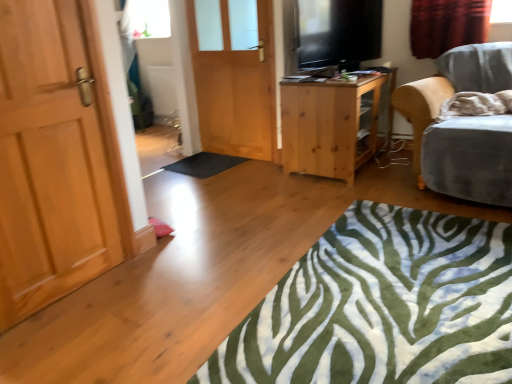
Locate an element on the screen. The height and width of the screenshot is (384, 512). vacant space behind green zebra-patterned rug at lower center is located at coordinates (294, 195).